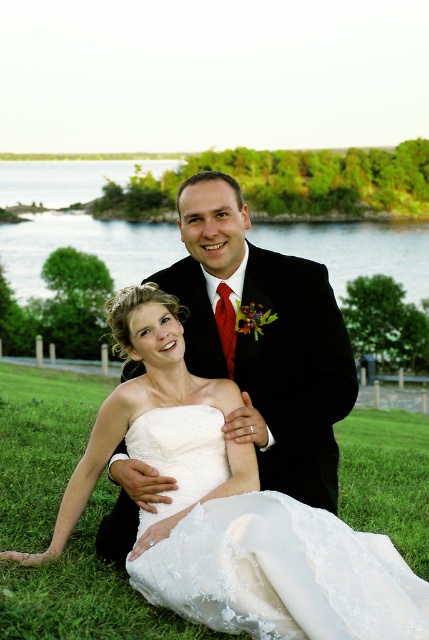
Between point (88, 440) and point (274, 568), which one is positioned behind?

The point (88, 440) is behind.

Can you confirm if white satin dress at center is smaller than white lace dress at lower center?

Incorrect, white satin dress at center is not smaller in size than white lace dress at lower center.

Locate an element on the screen. Image resolution: width=429 pixels, height=640 pixels. white satin dress at center is located at coordinates (227, 509).

In the scene shown: Is black satin suit at center closer to camera compared to white lace dress at lower center?

No, it is not.

Does point (283, 312) lie behind point (135, 422)?

Yes, point (283, 312) is farther from viewer.

This screenshot has width=429, height=640. I want to click on black satin suit at center, so pyautogui.click(x=263, y=339).

Who is lower down, white satin dress at center or black satin suit at center?

white satin dress at center

Can you confirm if white satin dress at center is thinner than black satin suit at center?

Incorrect, white satin dress at center's width is not less than black satin suit at center's.

At what (x,y) coordinates should I click in order to perform the action: click on white satin dress at center. Please return your answer as a coordinate pair (x, y). Looking at the image, I should click on 227,509.